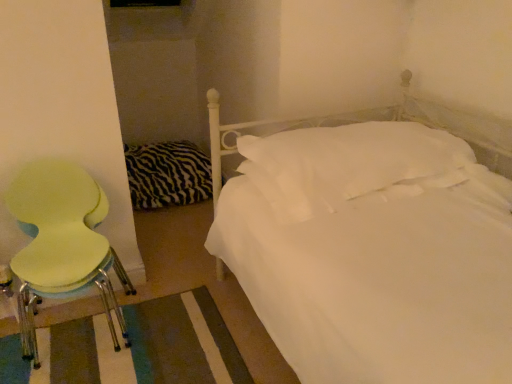
You are a GUI agent. You are given a task and a screenshot of the screen. Output one action in this format:
    pyautogui.click(x=<x>, y=<y>)
    Task: Click on the free space to the right of light green plastic chair at left
    This screenshot has width=512, height=384.
    Given the screenshot: What is the action you would take?
    pyautogui.click(x=177, y=329)